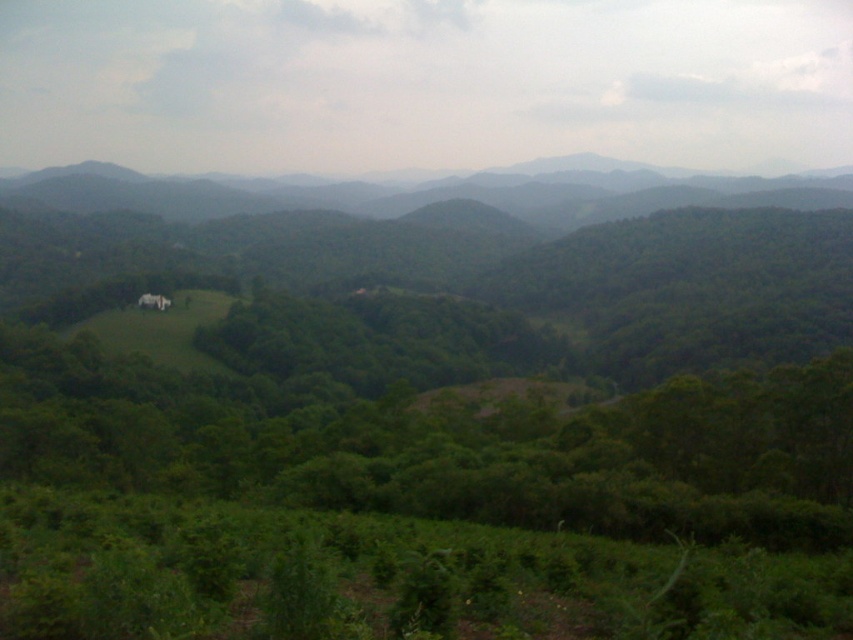
You are a hiker planning to take a photo of the green leafy tree at center and the green forested mountain at upper center. Which object should you focus on first if you want both to be in sharp focus?

You should focus on the green forested mountain at upper center first because it is farther away than the green leafy tree at center, ensuring both will be in focus when using depth of field properly.

You are standing at the point labeled point (659, 337) in the image. You want to walk towards the point labeled point (550, 202). Which direction should you move to get closer to your destination?

Since point (659, 337) is closer to the camera than point (550, 202), you should move towards the background to reach your destination.